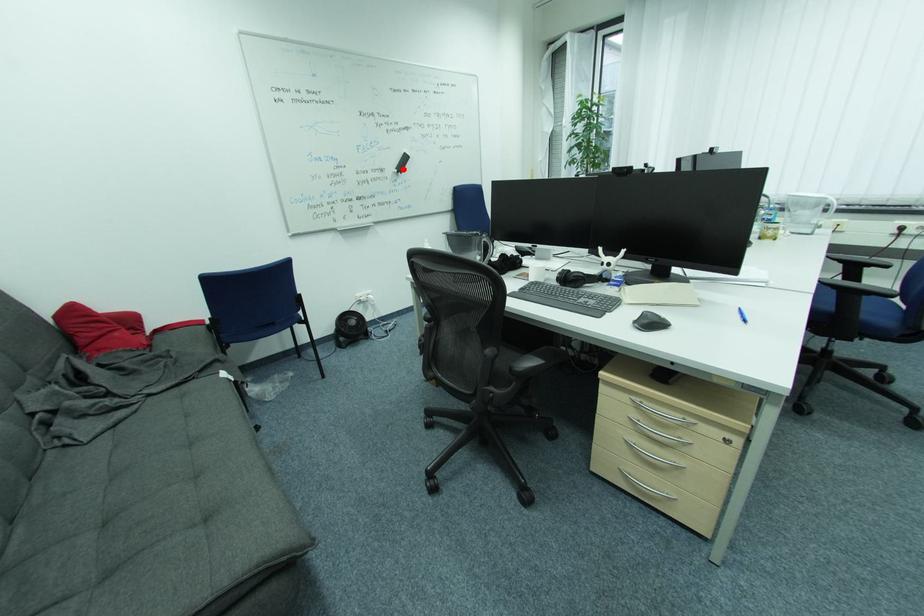
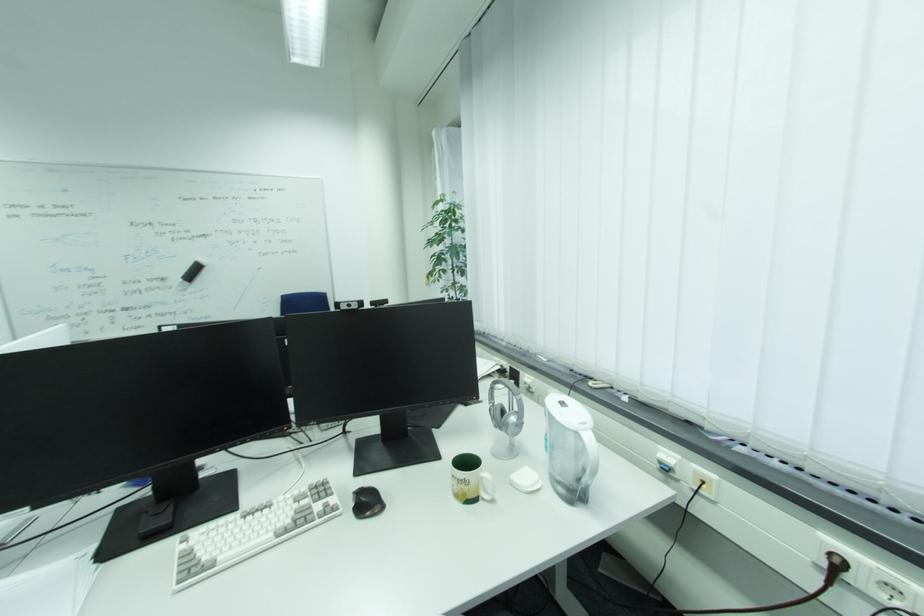
Find the pixel in the second image that matches the highlighted location in the first image.

(189, 278)